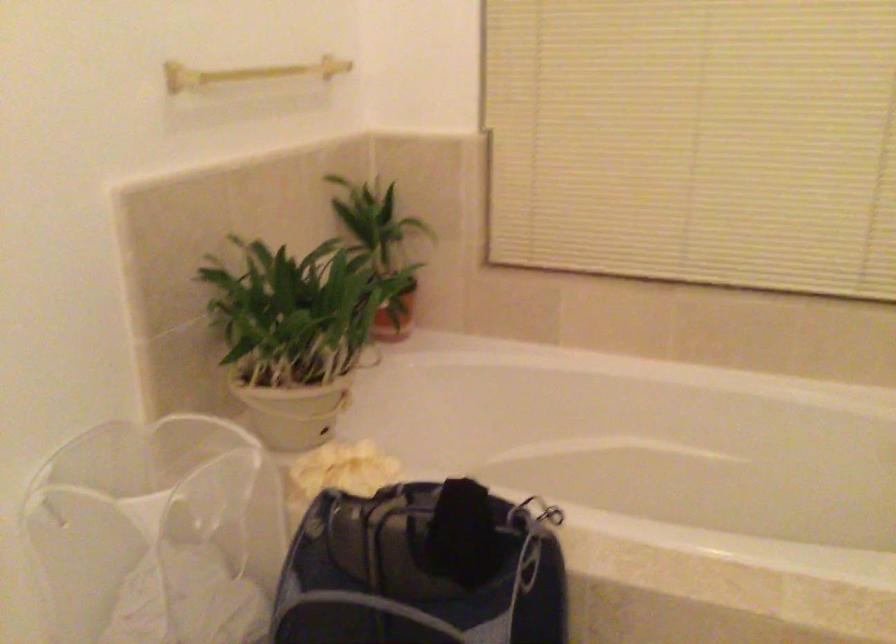
Find the location of a particular element. This screenshot has height=644, width=896. gold towel rack is located at coordinates (250, 73).